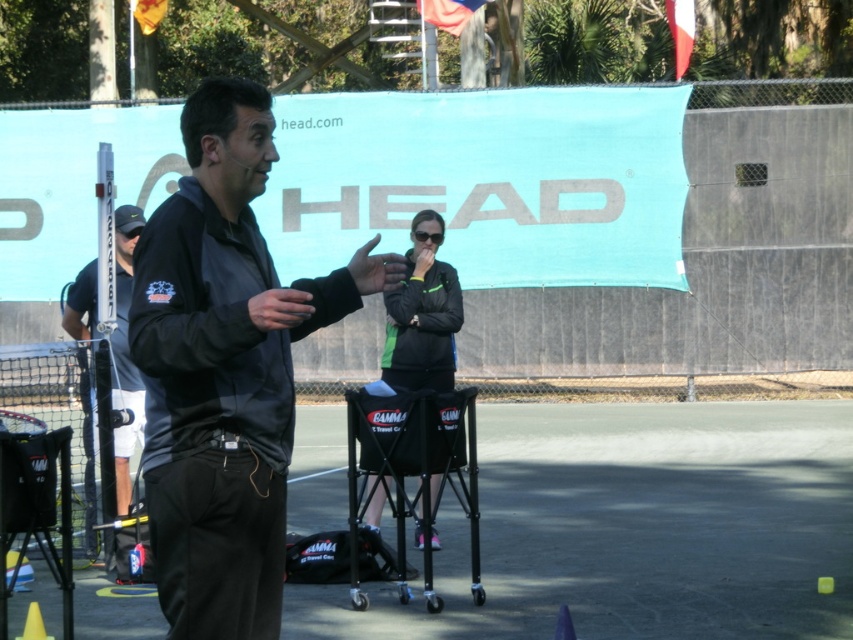
Does black matte jacket at center appear over black matte pole at left?

Correct, black matte jacket at center is located above black matte pole at left.

Who is taller, black matte jacket at center or black matte pole at left?

black matte pole at left

Is point (233, 387) less distant than point (77, 278)?

Yes, point (233, 387) is closer to viewer.

Locate an element on the screen. black matte jacket at center is located at coordinates (224, 371).

Is black matte jacket at center in front of yellow matte cone at lower left?

Yes.

Between point (265, 401) and point (32, 611), which one is positioned behind?

Point (32, 611)

Identify the location of black matte jacket at center. (224, 371).

Between black fabric court at center and black matte jacket at center, which one appears on the left side from the viewer's perspective?

Positioned to the left is black matte jacket at center.

From the picture: Between black fabric court at center and black matte jacket at center, which one is positioned lower?

black fabric court at center is lower down.

Is point (349, 608) in front of point (212, 220)?

No.

Image resolution: width=853 pixels, height=640 pixels. Find the location of `black fabric court at center`. black fabric court at center is located at coordinates (634, 528).